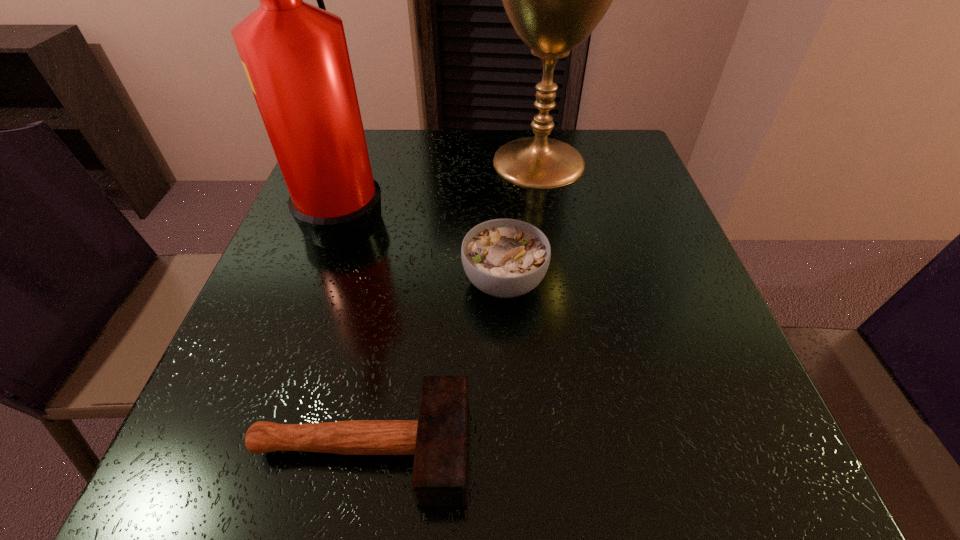
In order to click on fire extinguisher at the far edge in this screenshot , I will do `click(295, 55)`.

Locate an element on the screen. This screenshot has height=540, width=960. object present at the near edge is located at coordinates (438, 440).

Locate an element on the screen. The height and width of the screenshot is (540, 960). fire extinguisher positioned at the left edge is located at coordinates (295, 55).

I want to click on mallet that is at the left edge, so tap(438, 440).

Where is `object located at the right edge`? The width and height of the screenshot is (960, 540). object located at the right edge is located at coordinates (554, 0).

Find the location of a particular element. Image resolution: width=960 pixels, height=540 pixels. object that is at the far left corner is located at coordinates (295, 55).

Where is `object at the near left corner`? object at the near left corner is located at coordinates (438, 440).

This screenshot has width=960, height=540. Identify the location of object present at the far right corner. (554, 0).

Locate an element on the screen. free space at the far edge is located at coordinates (522, 135).

The image size is (960, 540). What are the coordinates of `free space at the near edge of the desktop` in the screenshot? It's located at (312, 461).